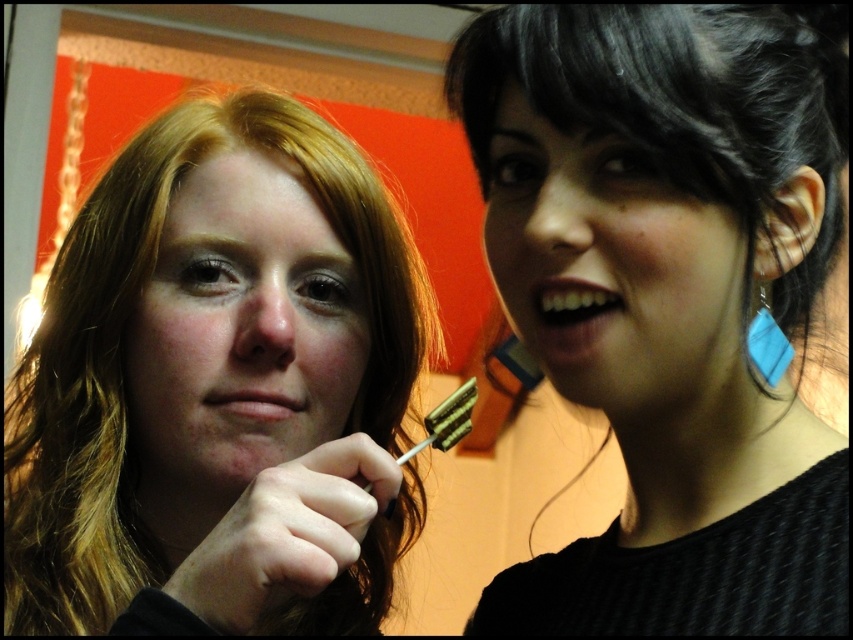
You are a photographer trying to capture a clear shot of the black matte hair at upper right and the white glossy teeth at upper right. Since you can only focus on one subject at a time, which one should you choose to ensure the other remains in the background?

You should focus on the black matte hair at upper right because it is closer to the viewer, which will keep the white glossy teeth at upper right in the background and out of focus.